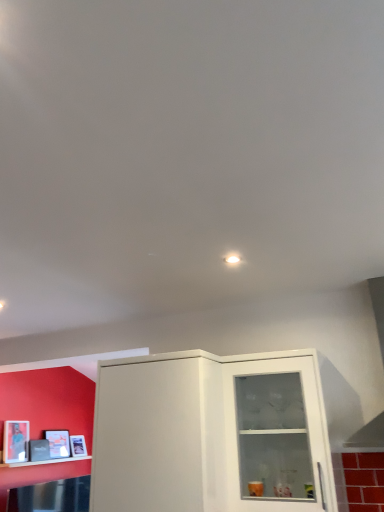
Find the location of a particular element. Image resolution: width=384 pixels, height=512 pixels. matte white cabinet at center is located at coordinates (211, 434).

What do you see at coordinates (45, 462) in the screenshot?
I see `white glossy shelf at lower left` at bounding box center [45, 462].

Where is `matte white cabinet at center`? This screenshot has width=384, height=512. matte white cabinet at center is located at coordinates (211, 434).

Looking at this image, does matte white cabinet at center have a lesser width compared to white glossy shelf at lower left?

In fact, matte white cabinet at center might be wider than white glossy shelf at lower left.

Considering the sizes of matte white cabinet at center and white glossy shelf at lower left in the image, is matte white cabinet at center bigger or smaller than white glossy shelf at lower left?

Considering their sizes, matte white cabinet at center takes up more space than white glossy shelf at lower left.

Is matte white cabinet at center far from white glossy shelf at lower left?

Absolutely, matte white cabinet at center is distant from white glossy shelf at lower left.

From a real-world perspective, does matte white cabinet at center sit lower than white glossy shelf at lower left?

No, from a real-world perspective, matte white cabinet at center is not beneath white glossy shelf at lower left.

From their relative heights in the image, would you say transparent glass cabinet at center is taller or shorter than white glossy shelf at lower left?

Clearly, transparent glass cabinet at center is taller compared to white glossy shelf at lower left.

Could you tell me if transparent glass cabinet at center is turned towards white glossy shelf at lower left?

No, transparent glass cabinet at center is not turned towards white glossy shelf at lower left.

Looking at this image, from the image's perspective, between transparent glass cabinet at center and white glossy shelf at lower left, who is located below?

white glossy shelf at lower left, from the image's perspective.

Considering their positions, is transparent glass cabinet at center located in front of or behind white glossy shelf at lower left?

transparent glass cabinet at center is positioned closer to the viewer than white glossy shelf at lower left.

In terms of height, does white glossy shelf at lower left look taller or shorter compared to matte white cabinet at center?

Considering their sizes, white glossy shelf at lower left has less height than matte white cabinet at center.

Is white glossy shelf at lower left located outside matte white cabinet at center?

Yes, white glossy shelf at lower left is outside of matte white cabinet at center.

How distant is white glossy shelf at lower left from matte white cabinet at center?

white glossy shelf at lower left and matte white cabinet at center are 7.78 feet apart.

At what (x,y) coordinates should I click in order to perform the action: click on cabinetry lying above the white glossy shelf at lower left (from the image's perspective). Please return your answer as a coordinate pair (x, y). The image size is (384, 512). Looking at the image, I should click on (211, 434).

Is there a large distance between transparent glass cabinet at center and matte white cabinet at center?

That's not correct — transparent glass cabinet at center is a little close to matte white cabinet at center.

From the picture: Is the depth of transparent glass cabinet at center greater than that of matte white cabinet at center?

Yes, the depth of transparent glass cabinet at center is greater than that of matte white cabinet at center.

Can you confirm if transparent glass cabinet at center is positioned to the left of matte white cabinet at center?

No, transparent glass cabinet at center is not to the left of matte white cabinet at center.

Which is closer to the camera, (253,474) or (288,488)?

The point (288,488) is in front.

Is white glossy shelf at lower left smaller than transparent glass cabinet at center?

Indeed, white glossy shelf at lower left has a smaller size compared to transparent glass cabinet at center.

Could you tell me if white glossy shelf at lower left is turned towards transparent glass cabinet at center?

No.

Considering the sizes of objects white glossy shelf at lower left and transparent glass cabinet at center in the image provided, who is wider, white glossy shelf at lower left or transparent glass cabinet at center?

transparent glass cabinet at center.

Which is more to the left, white glossy shelf at lower left or transparent glass cabinet at center?

white glossy shelf at lower left.

Can you confirm if matte white cabinet at center is bigger than transparent glass cabinet at center?

Correct, matte white cabinet at center is larger in size than transparent glass cabinet at center.

Is matte white cabinet at center in front of or behind transparent glass cabinet at center in the image?

matte white cabinet at center is in front of transparent glass cabinet at center.

Is matte white cabinet at center facing away from transparent glass cabinet at center?

That's not correct — matte white cabinet at center is not looking away from transparent glass cabinet at center.

Is matte white cabinet at center completely or partially outside of transparent glass cabinet at center?

Absolutely, matte white cabinet at center is external to transparent glass cabinet at center.

Find the location of a particular element. cabinetry located on the right of white glossy shelf at lower left is located at coordinates (211, 434).

This screenshot has height=512, width=384. Find the location of `glass door in front of the white glossy shelf at lower left`. glass door in front of the white glossy shelf at lower left is located at coordinates (277, 435).

Estimate the real-world distances between objects in this image. Which object is further from white glossy shelf at lower left, matte white cabinet at center or transparent glass cabinet at center?

transparent glass cabinet at center lies further to white glossy shelf at lower left than the other object.

Based on their spatial positions, is transparent glass cabinet at center or white glossy shelf at lower left further from matte white cabinet at center?

white glossy shelf at lower left is positioned further to the anchor matte white cabinet at center.

When comparing their distances from transparent glass cabinet at center, does matte white cabinet at center or white glossy shelf at lower left seem further?

white glossy shelf at lower left lies further to transparent glass cabinet at center than the other object.

Based on their spatial positions, is white glossy shelf at lower left or transparent glass cabinet at center closer to matte white cabinet at center?

The object closer to matte white cabinet at center is transparent glass cabinet at center.

In the scene shown: Looking at the image, which one is located closer to transparent glass cabinet at center, white glossy shelf at lower left or matte white cabinet at center?

Among the two, matte white cabinet at center is located nearer to transparent glass cabinet at center.

When comparing their distances from white glossy shelf at lower left, does transparent glass cabinet at center or matte white cabinet at center seem closer?

Based on the image, matte white cabinet at center appears to be nearer to white glossy shelf at lower left.

Find the location of a particular element. This screenshot has height=512, width=384. glass door located between matte white cabinet at center and white glossy shelf at lower left in the depth direction is located at coordinates (277, 435).